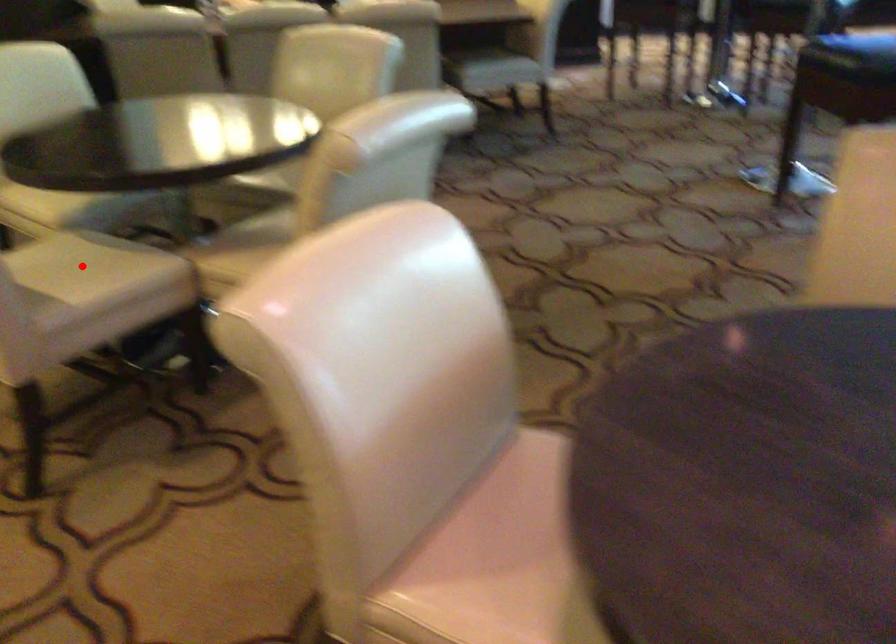
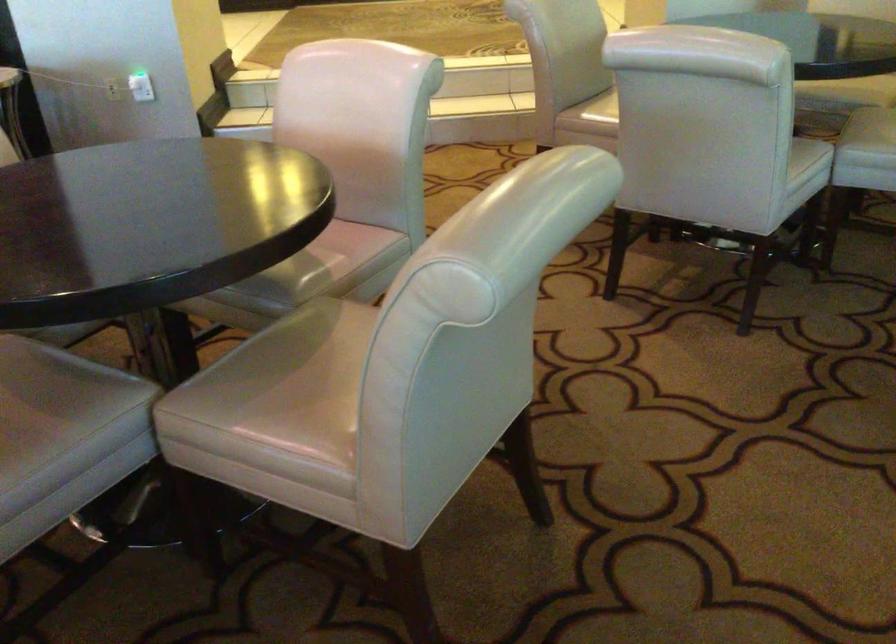
Question: I am providing you with two images of the same scene from different viewpoints. A red point is marked on the first image. At the location where the point appears in image 1, is it still visible in image 2?

Choices:
 (A) Yes
 (B) No

Answer: (B)